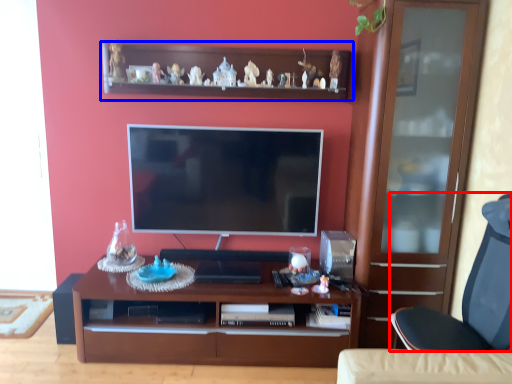
Question: Which point is further to the camera, chair (highlighted by a red box) or shelf (highlighted by a blue box)?

Choices:
 (A) chair
 (B) shelf

Answer: (B)